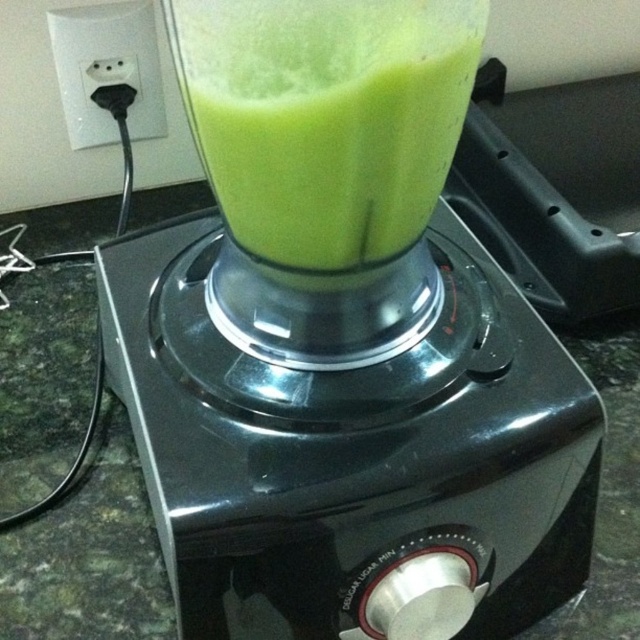
You are a kitchen assistant who needs to pour the green matte liquid at center into a cup. The cup you have can only hold items narrower than the black plastic plug at upper left. Will the liquid fit into the cup?

The green matte liquid at center might be wider than the black plastic plug at upper left, so it may not fit into the cup if the cup can only hold items narrower than the plug.

You are a kitchen assistant and need to unplug the black plastic plug at upper left while the blender is running. Is the green matte liquid at center in a position that could spill if you move the plug?

The green matte liquid at center is to the right of the black plastic plug at upper left, so moving the plug might not directly affect the blender container. However, unplugging the blender while it is running could cause it to stop abruptly, potentially leading to spills due to sudden movement. Ensure safety precautions are taken before unplugging.

You are a delivery person who just arrived at a house. You need to place a small package on the countertop where the blender is located. The package requires a flat surface at least 30 centimeters away from the green matte liquid at center to avoid spills. Is the distance sufficient for placing the package there?

The green matte liquid at center is 36.41 centimeters away from the viewer. Since the required distance is at least 30 centimeters, the package can be placed on the countertop as the distance meets the requirement.